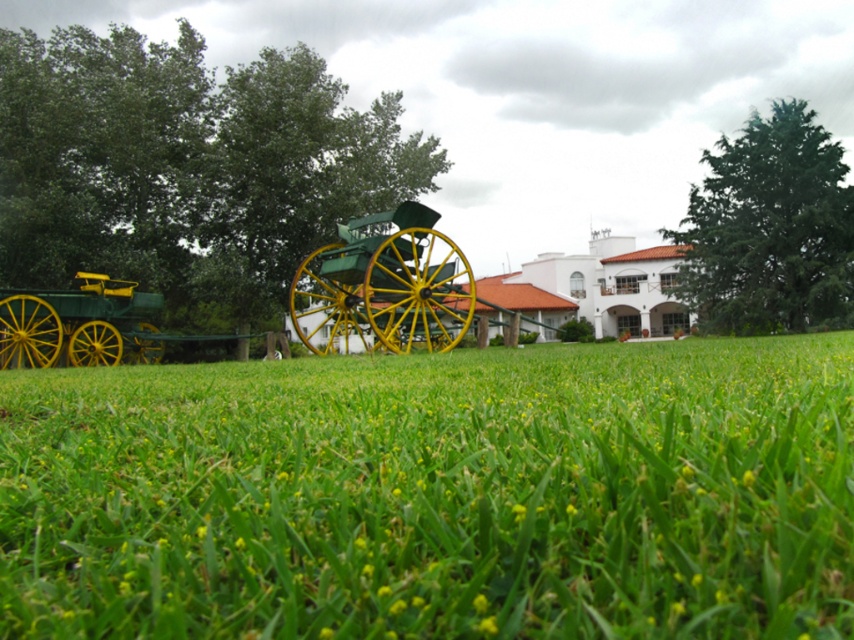
Question: Which object is farther from the camera taking this photo?

Choices:
 (A) green matte wagon at left
 (B) green grass at center
 (C) green polished wood wagon at center

Answer: (A)

Question: Among these objects, which one is farthest from the camera?

Choices:
 (A) green matte wagon at left
 (B) green polished wood wagon at center
 (C) green grass at center

Answer: (A)

Question: Is green grass at center bigger than green polished wood wagon at center?

Choices:
 (A) no
 (B) yes

Answer: (A)

Question: Does green polished wood wagon at center appear under green matte wagon at left?

Choices:
 (A) yes
 (B) no

Answer: (B)

Question: Is green polished wood wagon at center above green matte wagon at left?

Choices:
 (A) no
 (B) yes

Answer: (B)

Question: Which point is closer to the camera?

Choices:
 (A) (363, 330)
 (B) (451, 365)

Answer: (B)